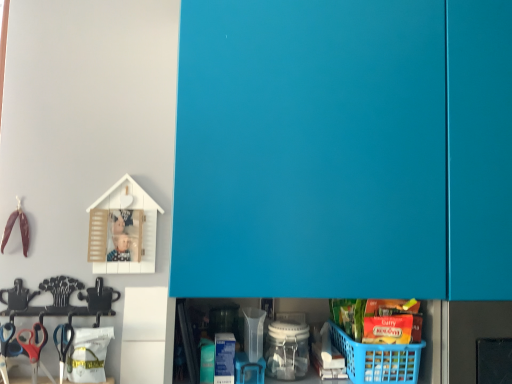
Question: From a real-world perspective, is blue plastic basket at lower right over teal matte cabinet doors at upper center?

Choices:
 (A) yes
 (B) no

Answer: (B)

Question: Can you confirm if blue plastic basket at lower right is positioned to the left of teal matte cabinet doors at upper center?

Choices:
 (A) yes
 (B) no

Answer: (A)

Question: Can you confirm if blue plastic basket at lower right is smaller than teal matte cabinet doors at upper center?

Choices:
 (A) yes
 (B) no

Answer: (A)

Question: Are blue plastic basket at lower right and teal matte cabinet doors at upper center making contact?

Choices:
 (A) yes
 (B) no

Answer: (B)

Question: Considering the relative sizes of blue plastic basket at lower right and teal matte cabinet doors at upper center in the image provided, is blue plastic basket at lower right bigger than teal matte cabinet doors at upper center?

Choices:
 (A) no
 (B) yes

Answer: (A)

Question: Is blue plastic basket at lower right far away from teal matte cabinet doors at upper center?

Choices:
 (A) yes
 (B) no

Answer: (B)

Question: Are blue plastic basket at lower right and pink plastic scissors at lower left located far from each other?

Choices:
 (A) yes
 (B) no

Answer: (B)

Question: From a real-world perspective, is blue plastic basket at lower right physically above pink plastic scissors at lower left?

Choices:
 (A) yes
 (B) no

Answer: (A)

Question: Is blue plastic basket at lower right facing towards pink plastic scissors at lower left?

Choices:
 (A) yes
 (B) no

Answer: (B)

Question: From a real-world perspective, is blue plastic basket at lower right physically below pink plastic scissors at lower left?

Choices:
 (A) yes
 (B) no

Answer: (B)

Question: Considering the relative sizes of blue plastic basket at lower right and pink plastic scissors at lower left in the image provided, is blue plastic basket at lower right taller than pink plastic scissors at lower left?

Choices:
 (A) no
 (B) yes

Answer: (A)

Question: Does blue plastic basket at lower right lie behind pink plastic scissors at lower left?

Choices:
 (A) no
 (B) yes

Answer: (A)

Question: Is pink plastic scissors at lower left taller than teal matte cabinet doors at upper center?

Choices:
 (A) yes
 (B) no

Answer: (B)